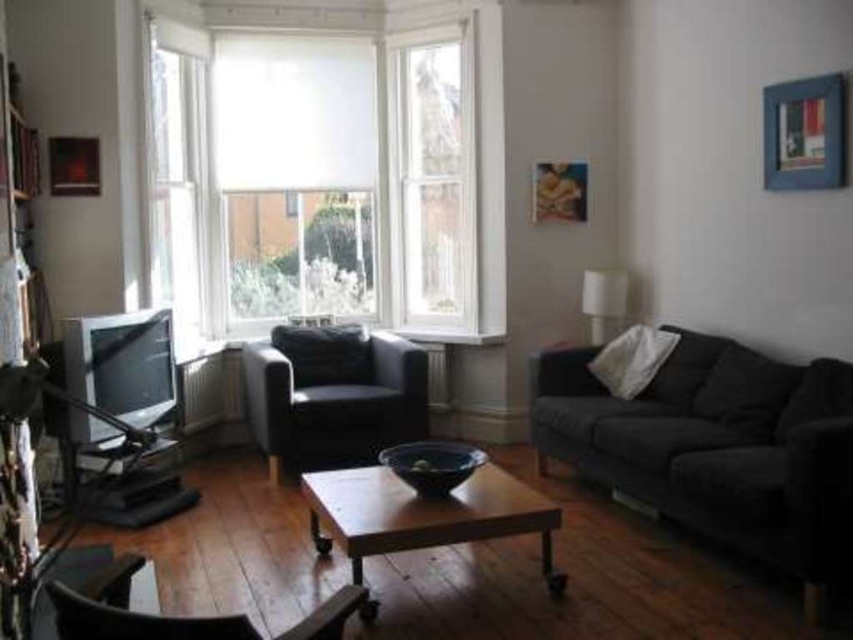
Question: Can you confirm if dark gray leather armchair at center is positioned to the left of wooden coffee table at center?

Choices:
 (A) no
 (B) yes

Answer: (B)

Question: Which object appears closest to the camera in this image?

Choices:
 (A) dark gray fabric couch at right
 (B) white matte window at center
 (C) matte black chair at lower left
 (D) dark gray leather armchair at center

Answer: (C)

Question: Is white matte window at center closer to camera compared to dark gray fabric couch at right?

Choices:
 (A) no
 (B) yes

Answer: (A)

Question: Which point is closer to the camera taking this photo?

Choices:
 (A) (285, 401)
 (B) (491, 536)
 (C) (369, 316)

Answer: (B)

Question: Based on their relative distances, which object is nearer to the matte black chair at lower left?

Choices:
 (A) dark gray leather armchair at center
 (B) white matte window at center
 (C) dark gray fabric couch at right

Answer: (C)

Question: Is dark gray fabric couch at right to the left of wooden coffee table at center from the viewer's perspective?

Choices:
 (A) yes
 (B) no

Answer: (B)